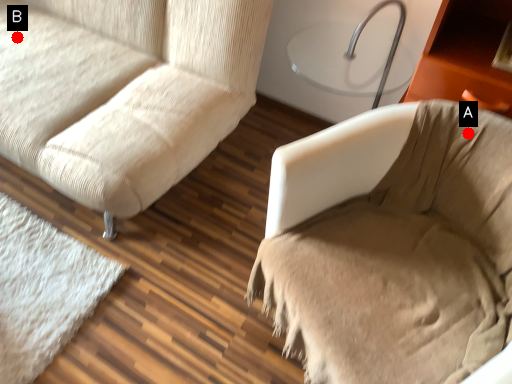
Question: Two points are circled on the image, labeled by A and B beside each circle. Which point is farther to the camera?

Choices:
 (A) A is further
 (B) B is further

Answer: (B)